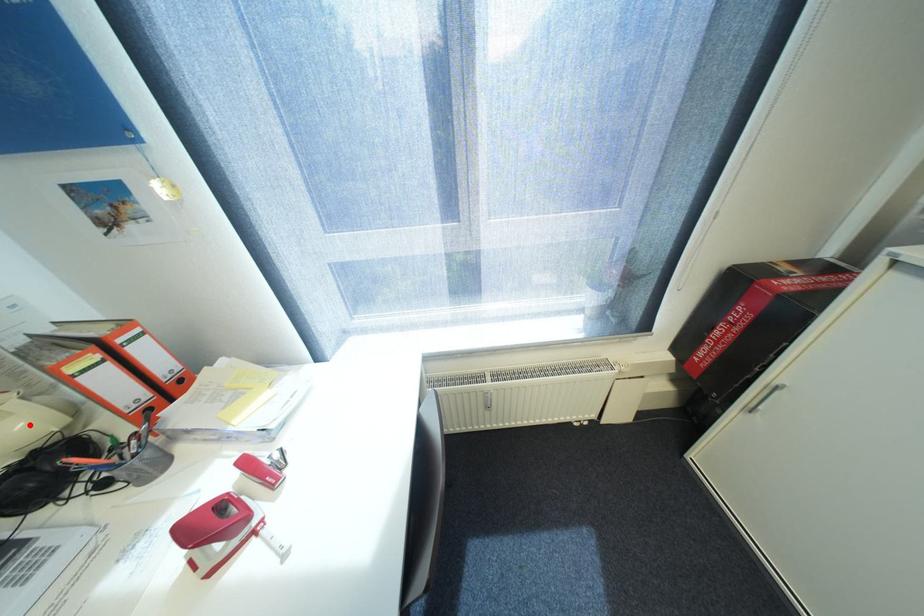
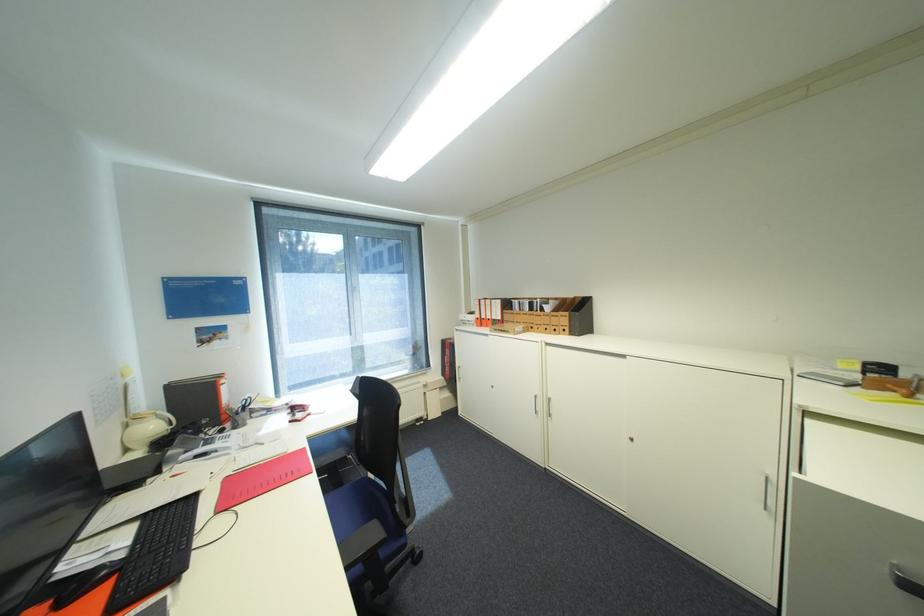
Locate, in the second image, the point that corresponds to the highlighted location in the first image.

(161, 427)